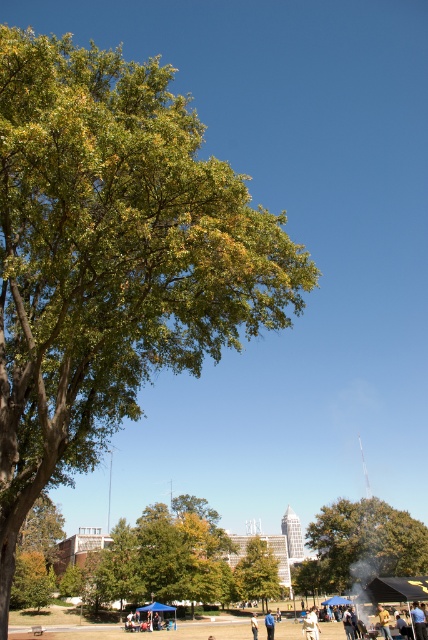
You are a photographer standing in the park and want to take a photo that includes both the green matte tree at center and the yellow fabric at lower center. Which object should you position closer to the camera to ensure both are in focus?

The green matte tree at center is further to the viewer than yellow fabric at lower center, so you should position the green matte tree at center closer to the camera to ensure both are in focus.

You are planning to set up a picnic blanket in the park shown in the image. There is a green leafy tree at upper left. Considering the tree is at point 0.403 on the horizontal axis and 0.262 on the vertical axis, will the tree provide shade over your picnic area if you place it at the center of the image?

The green leafy tree at upper left is located at point 0.403 on the horizontal axis and 0.262 on the vertical axis. Since the tree is positioned towards the upper left corner, its shade would likely extend towards the lower right direction. If your picnic area is at the center of the image, it might be partially shaded depending on the tree canopy spread, but the exact coverage isn

You are planning to set up a picnic blanket. You have a picnic blanket that is 2 meters wide. You see the green matte tree at center and the yellow fabric at lower center in the image. Which object is wider than your picnic blanket?

The green matte tree at center is wider than the yellow fabric at lower center. Since the green matte tree at center is wider than the yellow fabric at lower center, and the picnic blanket is 2 meters wide, it depends on the actual width of the tree. However, the description only states that the tree is wider than the fabric, so we cannot determine if it is wider than the blanket without more information. However, following the given data strictly, the question asks which object is wider than the picnic, so